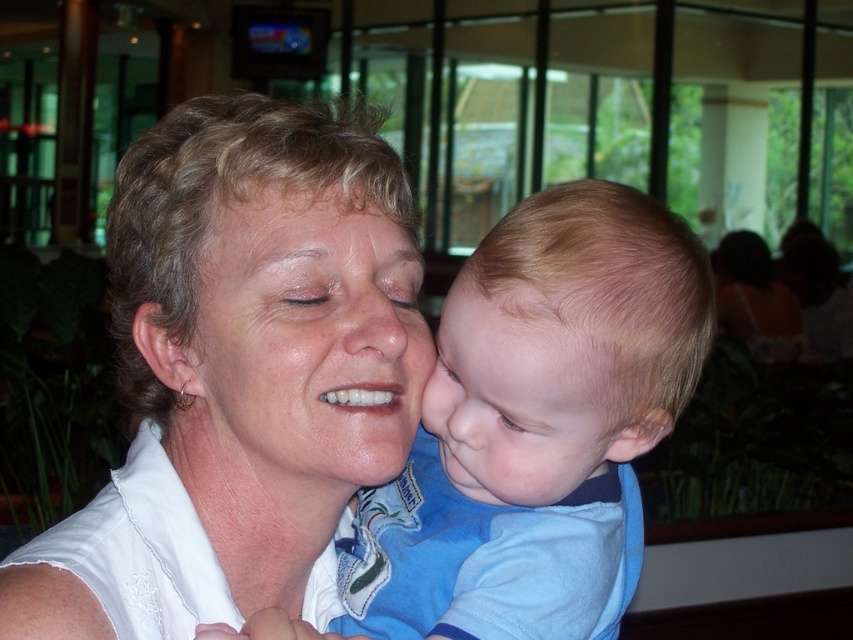
Which is below, smooth skin face at center or light brown hair at center?

light brown hair at center is below.

Is point (373, 284) positioned before point (555, 452)?

No.

You are a GUI agent. You are given a task and a screenshot of the screen. Output one action in this format:
    pyautogui.click(x=<x>, y=<y>)
    Task: Click on the smooth skin face at center
    
    Given the screenshot: What is the action you would take?
    pyautogui.click(x=302, y=346)

The width and height of the screenshot is (853, 640). In order to click on smooth skin face at center in this screenshot , I will do `click(302, 346)`.

Who is taller, blue cotton shirt at center or smooth skin nose at center?

Standing taller between the two is blue cotton shirt at center.

Can you confirm if blue cotton shirt at center is positioned to the right of smooth skin nose at center?

Incorrect, blue cotton shirt at center is not on the right side of smooth skin nose at center.

Where is `blue cotton shirt at center`? The height and width of the screenshot is (640, 853). blue cotton shirt at center is located at coordinates (538, 424).

This screenshot has width=853, height=640. What are the coordinates of `blue cotton shirt at center` in the screenshot? It's located at (538, 424).

Does white fabric at center appear under smooth skin face at center?

No, white fabric at center is not below smooth skin face at center.

Is point (41, 572) positioned after point (276, 236)?

No.

Does point (196, 474) come closer to viewer compared to point (299, 236)?

No.

In order to click on white fabric at center in this screenshot , I will do `click(267, 323)`.